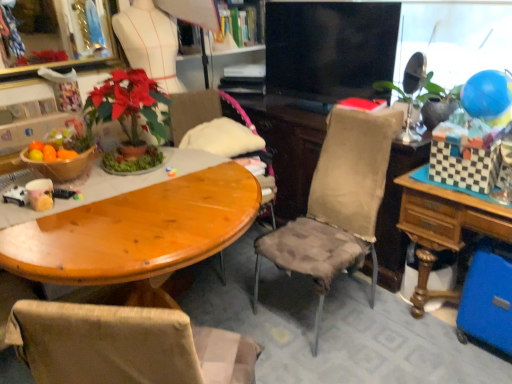
Question: Should I look upward or downward to see black glossy tv at center?

Choices:
 (A) down
 (B) up

Answer: (B)

Question: Should I look upward or downward to see wooden chair at center, the 2th chair from the front?

Choices:
 (A) up
 (B) down

Answer: (A)

Question: Considering the relative sizes of wooden chair at center, the 2th chair from the front, and textured beige chair at center, the second chair positioned from the back, in the image provided, is wooden chair at center, the 2th chair from the front, shorter than textured beige chair at center, the second chair positioned from the back,?

Choices:
 (A) yes
 (B) no

Answer: (A)

Question: Is wooden chair at center, the 2th chair from the front, thinner than textured beige chair at center, the second chair positioned from the back?

Choices:
 (A) yes
 (B) no

Answer: (B)

Question: Can you confirm if wooden chair at center, the first chair positioned from the back, is taller than textured beige chair at center, the 1th chair in the front-to-back sequence?

Choices:
 (A) no
 (B) yes

Answer: (A)

Question: Is wooden chair at center, the 2th chair from the front, not near textured beige chair at center, the 1th chair in the front-to-back sequence?

Choices:
 (A) no
 (B) yes

Answer: (A)

Question: Is wooden chair at center, the first chair positioned from the back, not within textured beige chair at center, the 1th chair in the front-to-back sequence?

Choices:
 (A) yes
 (B) no

Answer: (A)

Question: From a real-world perspective, does wooden chair at center, the 2th chair from the front, sit lower than textured beige chair at center, the second chair positioned from the back?

Choices:
 (A) no
 (B) yes

Answer: (A)

Question: Is wooden table at center far away from textured beige chair at center, the 1th chair in the front-to-back sequence?

Choices:
 (A) yes
 (B) no

Answer: (B)

Question: Is textured beige chair at center, the second chair positioned from the back, a part of wooden table at center?

Choices:
 (A) no
 (B) yes

Answer: (A)

Question: Considering the relative sizes of wooden table at center and textured beige chair at center, the 1th chair in the front-to-back sequence, in the image provided, is wooden table at center smaller than textured beige chair at center, the 1th chair in the front-to-back sequence,?

Choices:
 (A) no
 (B) yes

Answer: (B)

Question: Is wooden table at center wider than textured beige chair at center, the 1th chair in the front-to-back sequence?

Choices:
 (A) no
 (B) yes

Answer: (B)

Question: Is wooden table at center thinner than textured beige chair at center, the second chair positioned from the back?

Choices:
 (A) no
 (B) yes

Answer: (A)

Question: Can you confirm if wooden table at center is positioned to the left of textured beige chair at center, the second chair positioned from the back?

Choices:
 (A) no
 (B) yes

Answer: (B)

Question: Does blue rubber balloon at upper right have a greater height compared to black glossy tv at center?

Choices:
 (A) no
 (B) yes

Answer: (A)